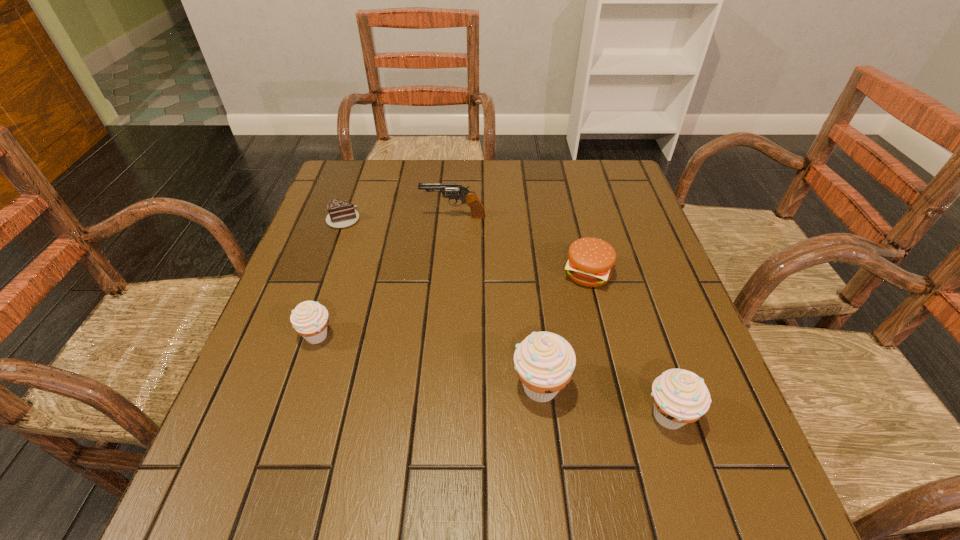
Find the location of a particular element. the leftmost muffin is located at coordinates (309, 319).

At what (x,y) coordinates should I click in order to perform the action: click on the shortest muffin. Please return your answer as a coordinate pair (x, y). The image size is (960, 540). Looking at the image, I should click on point(309,319).

Image resolution: width=960 pixels, height=540 pixels. I want to click on the tallest object, so click(x=544, y=361).

Image resolution: width=960 pixels, height=540 pixels. I want to click on the third object from right to left, so click(544, 361).

Find the location of a particular element. The image size is (960, 540). the second shortest muffin is located at coordinates (680, 396).

In order to click on the fourth nearest object in this screenshot , I will do `click(590, 261)`.

Where is `the second shortest object`? The width and height of the screenshot is (960, 540). the second shortest object is located at coordinates (590, 261).

At what (x,y) coordinates should I click in order to perform the action: click on the shortest object. Please return your answer as a coordinate pair (x, y). This screenshot has height=540, width=960. Looking at the image, I should click on 342,214.

You are a GUI agent. You are given a task and a screenshot of the screen. Output one action in this format:
    pyautogui.click(x=<x>, y=<y>)
    Task: Click on the gun
    The width and height of the screenshot is (960, 540).
    Given the screenshot: What is the action you would take?
    pyautogui.click(x=470, y=198)

Locate an element on the screen. vacant space situated on the front of the farthest muffin is located at coordinates (299, 395).